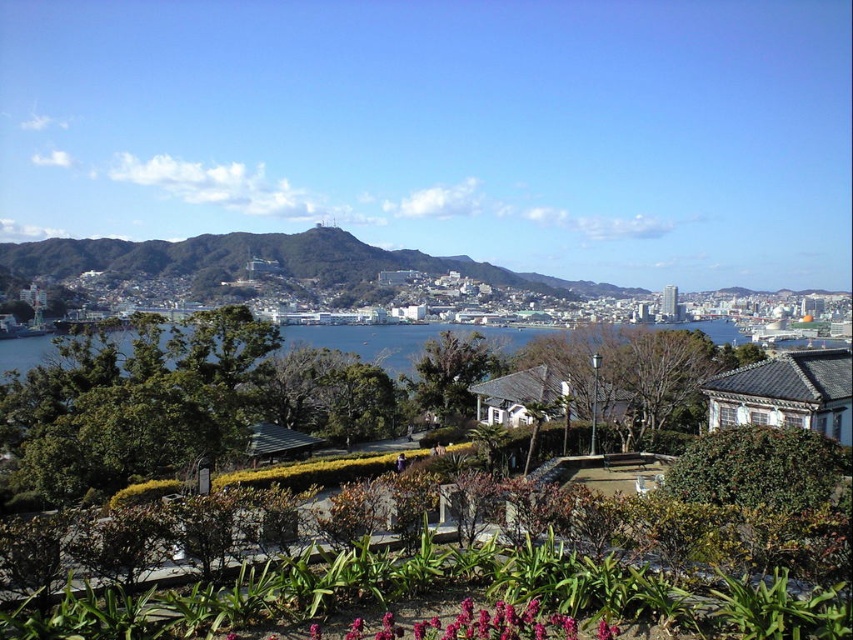
You are a tourist standing at the entrance of the coastal cityscape scene. You see the green leafy garden at lower center and the green grassy hill at center. Which of these two features is closer to you?

The green leafy garden at lower center is closer to you because it is positioned in front of the green grassy hill at center.

You are a landscape architect designing a new park. You need to place a large statue that requires 10 meters of space. You have two options for placement areas in the image. The first option is the green leafy garden at lower center, and the second option is the green grassy hill at center. Based on the scene description, which area would you choose and why?

The green grassy hill at center is a better choice because it has a greater width than the green leafy garden at lower center, providing sufficient space for the statue requiring 10 meters of space.

You are planning to host a small outdoor event and need to choose between the green leafy garden at lower center and the green grassy hill at center for the event location. Based on their sizes, which area can accommodate more guests?

The green grassy hill at center has a larger size compared to the green leafy garden at lower center, so it can accommodate more guests.